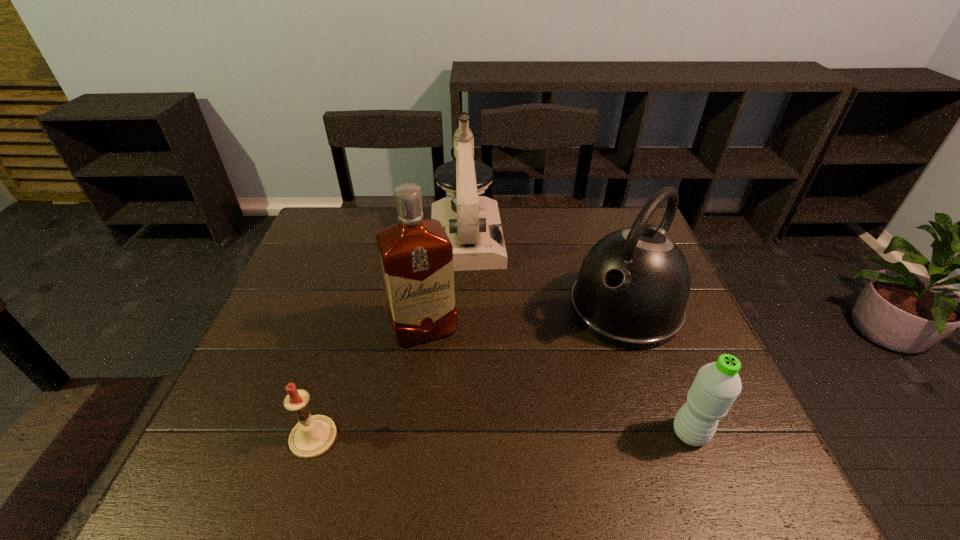
Locate an element on the screen. Image resolution: width=960 pixels, height=540 pixels. vacant space situated on the front label of the liquor is located at coordinates (452, 405).

You are a GUI agent. You are given a task and a screenshot of the screen. Output one action in this format:
    pyautogui.click(x=<x>, y=<y>)
    Task: Click on the free space located at the eyepiece of the microscope
    This screenshot has width=960, height=540.
    Given the screenshot: What is the action you would take?
    pyautogui.click(x=476, y=374)

Find the location of a particular element. This screenshot has height=540, width=960. vacant space positioned 0.260m at the eyepiece of the microscope is located at coordinates (473, 339).

Identify the location of free space located 0.390m at the eyepiece of the microscope. The width and height of the screenshot is (960, 540). (477, 381).

Locate an element on the screen. vacant space located on the spout of the third tallest object is located at coordinates (526, 422).

Locate an element on the screen. Image resolution: width=960 pixels, height=540 pixels. free region located 0.190m on the spout of the third tallest object is located at coordinates (555, 389).

I want to click on vacant space located on the spout of the third tallest object, so click(576, 364).

Locate an element on the screen. object that is at the far edge is located at coordinates (472, 223).

Locate an element on the screen. candle present at the near edge is located at coordinates (313, 435).

Locate an element on the screen. Image resolution: width=960 pixels, height=540 pixels. water bottle located at the near edge is located at coordinates (716, 386).